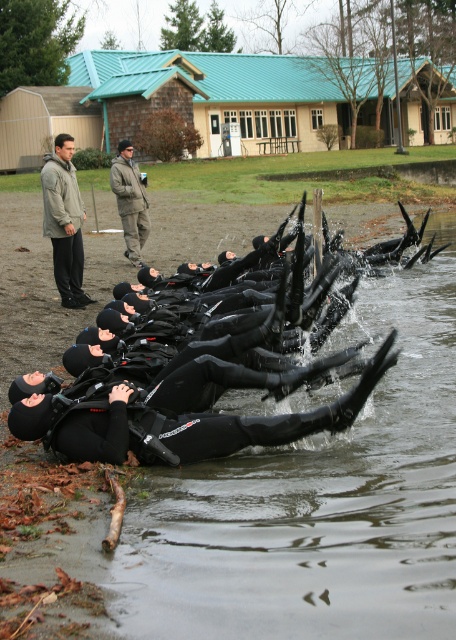
Question: Which of these objects is positioned closest to the khaki wool jacket at upper center?

Choices:
 (A) black matte wetsuit at center
 (B) gray woolen jacket at left

Answer: (B)

Question: Is black matte wetsuit at lower center thinner than gray woolen jacket at left?

Choices:
 (A) yes
 (B) no

Answer: (B)

Question: Which of the following is the closest to the observer?

Choices:
 (A) (62, 275)
 (B) (306, 444)
 (C) (289, 426)

Answer: (C)

Question: Observing the image, what is the correct spatial positioning of black matte wetsuit at center in reference to gray woolen jacket at left?

Choices:
 (A) left
 (B) right

Answer: (B)

Question: Is gray woolen jacket at left to the left of khaki wool jacket at upper center from the viewer's perspective?

Choices:
 (A) no
 (B) yes

Answer: (B)

Question: Which point appears closest to the camera in this image?

Choices:
 (A) [x=63, y=132]
 (B) [x=262, y=627]
 (C) [x=146, y=209]

Answer: (B)